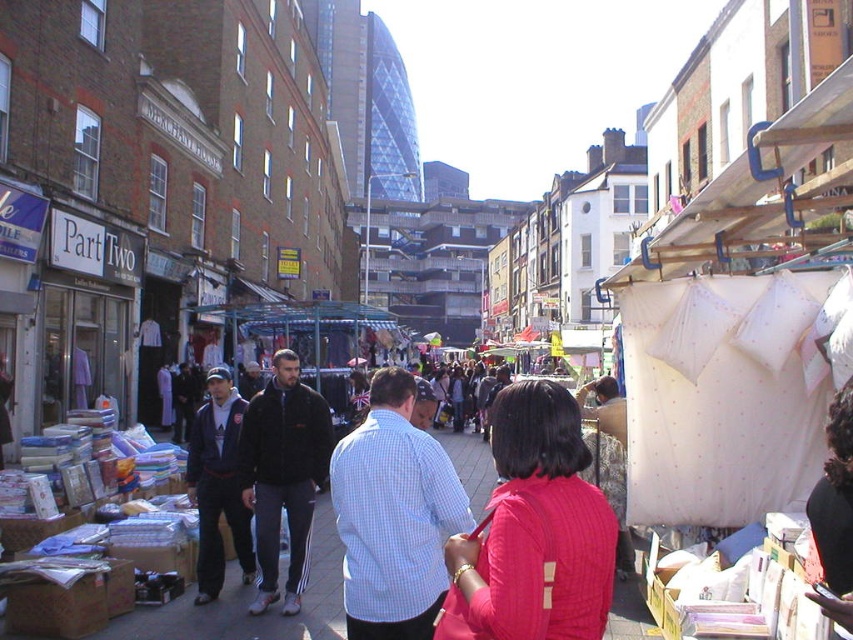
Question: Which point is farther to the camera?

Choices:
 (A) (265, 444)
 (B) (212, 449)

Answer: (B)

Question: Considering the relative positions of light blue checkered shirt at center and dark blue jacket at center in the image provided, where is light blue checkered shirt at center located with respect to dark blue jacket at center?

Choices:
 (A) below
 (B) above

Answer: (A)

Question: Is ribbed pink sweater at center positioned behind black fleece jacket at center?

Choices:
 (A) no
 (B) yes

Answer: (A)

Question: Which of the following is the farthest from the observer?

Choices:
 (A) (529, 413)
 (B) (344, 538)

Answer: (B)

Question: Can you confirm if light blue checkered shirt at center is positioned to the right of black fleece jacket at center?

Choices:
 (A) yes
 (B) no

Answer: (A)

Question: Which of the following is the closest to the observer?

Choices:
 (A) (424, 532)
 (B) (244, 545)
 (C) (548, 612)

Answer: (C)